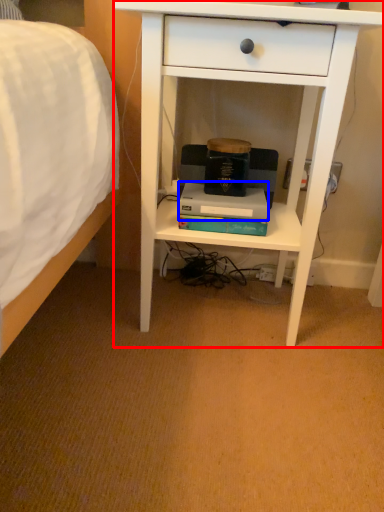
Question: Which object is further to the camera taking this photo, desk (highlighted by a red box) or paperback book (highlighted by a blue box)?

Choices:
 (A) desk
 (B) paperback book

Answer: (B)